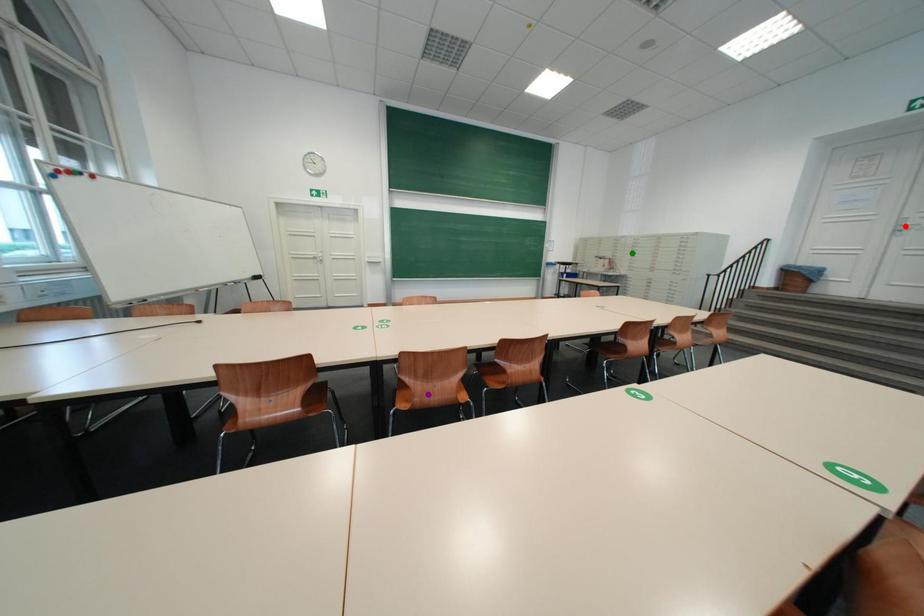
Order these from nearest to farthest:
- red point
- green point
- purple point

green point
red point
purple point